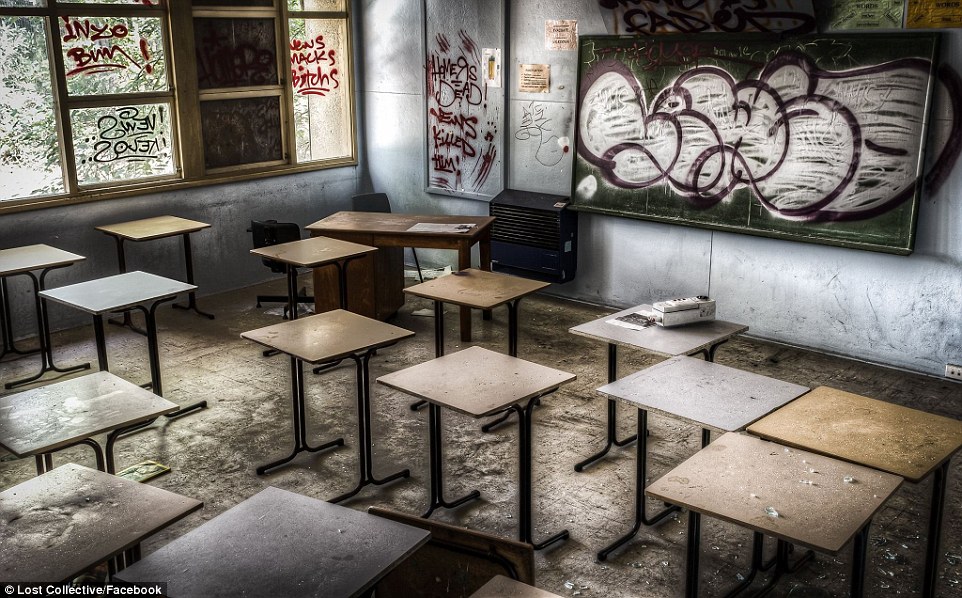
Locate an element on the screen. This screenshot has height=598, width=962. bulletin board is located at coordinates (469, 33).